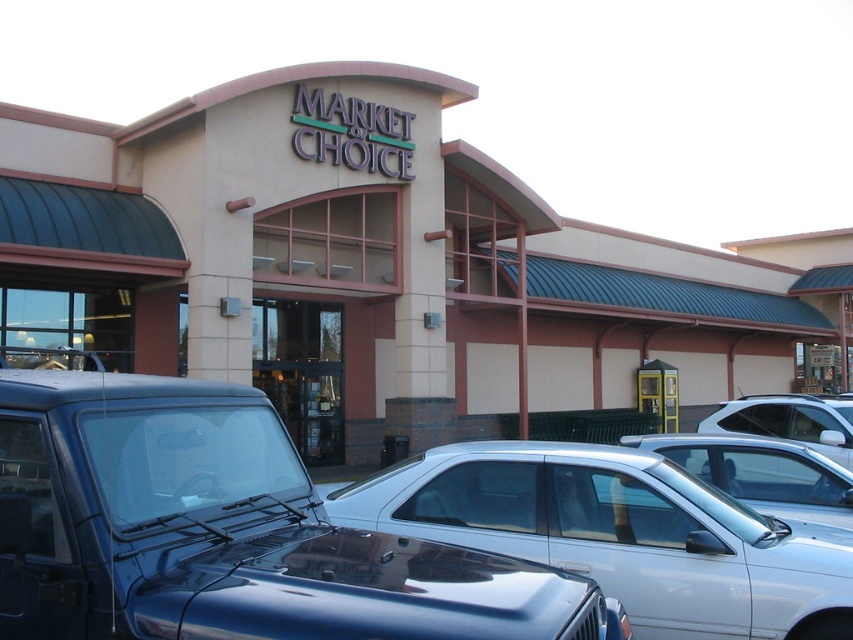
You are a delivery driver who needs to park your van between the shiny blue suv at center and the silver metallic sedan at center. Is there enough space between them for your van that is 6 meters long?

The shiny blue suv at center is to the left of the silver metallic sedan at center, but the distance between them isn not specified in the description. Without knowing the exact spacing, it is impossible to determine if the van will fit.

What is the color of the building located at the coordinates specified by point (380, 268)?

The point (380, 268) marks the beige smooth building at center, so the color is beige.